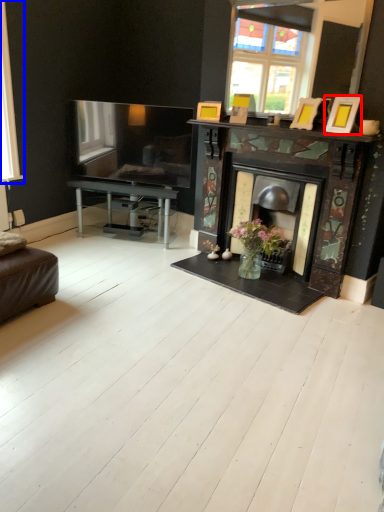
Question: Which object appears farthest to the camera in this image, picture frame (highlighted by a red box) or window (highlighted by a blue box)?

Choices:
 (A) picture frame
 (B) window

Answer: (B)